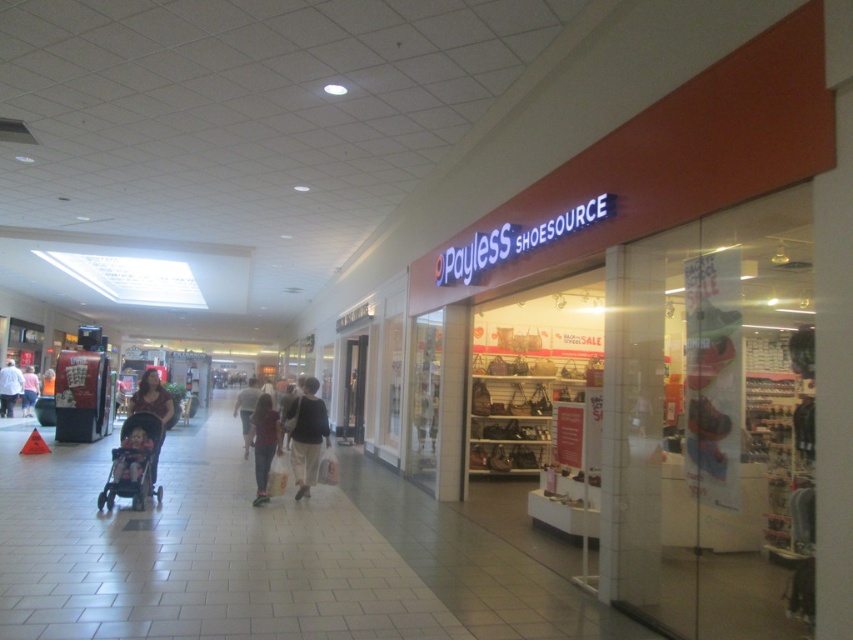
Can you confirm if matte brown stroller at left is taller than matte pink baby carriage at left?

Indeed, matte brown stroller at left has a greater height compared to matte pink baby carriage at left.

Which is behind, point (158, 408) or point (126, 436)?

Point (158, 408)

This screenshot has width=853, height=640. I want to click on matte brown stroller at left, so click(x=154, y=404).

Locate an element on the screen. This screenshot has height=640, width=853. matte brown stroller at left is located at coordinates (154, 404).

Does light brown leather jacket at center appear over white cotton shirt at center?

Incorrect, light brown leather jacket at center is not positioned above white cotton shirt at center.

Which is in front, point (241, 419) or point (6, 392)?

Point (241, 419)

This screenshot has width=853, height=640. I want to click on light brown leather jacket at center, so click(x=247, y=408).

Which of these two, silver metallic stroller at left or white cotton shirt at center, stands taller?

white cotton shirt at center

Does point (132, 486) come in front of point (9, 417)?

That is True.

I want to click on silver metallic stroller at left, so click(134, 461).